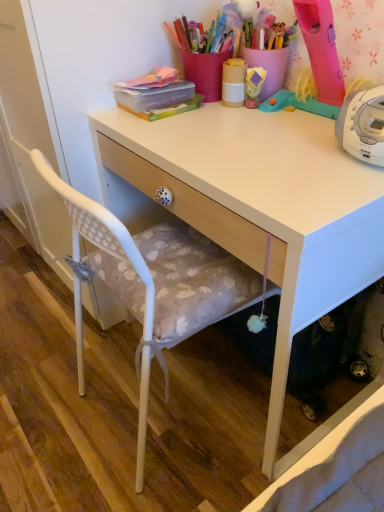
Identify the location of vacant space in between white matte desk at center and white plastic chair at left. (196, 460).